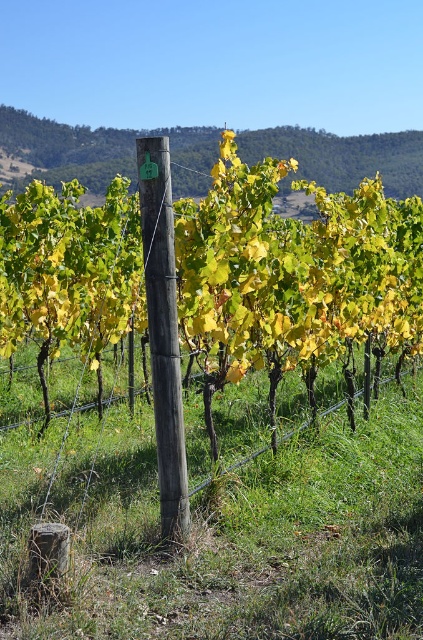
You are a vineyard worker who needs to attach a new label to the tallest post. Which post should you choose between the wooden post at center and the weathered wood post at center?

The wooden post at center is taller than the weathered wood post at center, so you should choose the wooden post at center to attach the new label.